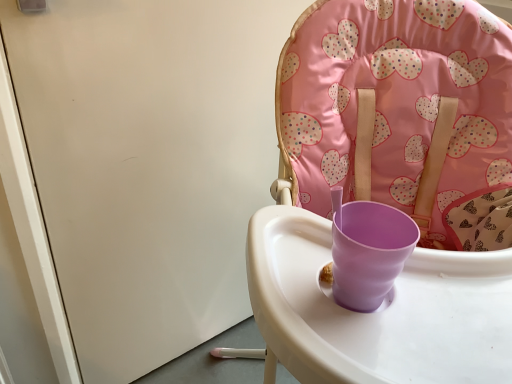
Question: Does matte plastic highchair at center come behind white glossy screen door at upper left?

Choices:
 (A) yes
 (B) no

Answer: (B)

Question: Is white glossy screen door at upper left inside matte plastic highchair at center?

Choices:
 (A) no
 (B) yes

Answer: (A)

Question: From a real-world perspective, is matte plastic highchair at center located beneath white glossy screen door at upper left?

Choices:
 (A) no
 (B) yes

Answer: (B)

Question: Is matte plastic highchair at center facing away from white glossy screen door at upper left?

Choices:
 (A) yes
 (B) no

Answer: (B)

Question: Considering the relative sizes of matte plastic highchair at center and white glossy screen door at upper left in the image provided, is matte plastic highchair at center thinner than white glossy screen door at upper left?

Choices:
 (A) no
 (B) yes

Answer: (A)

Question: Is matte plastic highchair at center located outside white glossy screen door at upper left?

Choices:
 (A) no
 (B) yes

Answer: (B)

Question: From a real-world perspective, is white glossy screen door at upper left positioned under matte plastic highchair at center based on gravity?

Choices:
 (A) no
 (B) yes

Answer: (A)

Question: Does white glossy screen door at upper left have a greater height compared to matte plastic highchair at center?

Choices:
 (A) yes
 (B) no

Answer: (B)

Question: Does white glossy screen door at upper left have a lesser width compared to matte plastic highchair at center?

Choices:
 (A) no
 (B) yes

Answer: (B)

Question: Is the position of white glossy screen door at upper left more distant than that of matte plastic highchair at center?

Choices:
 (A) yes
 (B) no

Answer: (A)

Question: Considering the relative sizes of white glossy screen door at upper left and matte plastic highchair at center in the image provided, is white glossy screen door at upper left bigger than matte plastic highchair at center?

Choices:
 (A) yes
 (B) no

Answer: (B)

Question: Is white glossy screen door at upper left not within matte plastic highchair at center?

Choices:
 (A) yes
 (B) no

Answer: (A)

Question: Visually, is matte plastic highchair at center positioned to the left or to the right of white glossy screen door at upper left?

Choices:
 (A) right
 (B) left

Answer: (A)